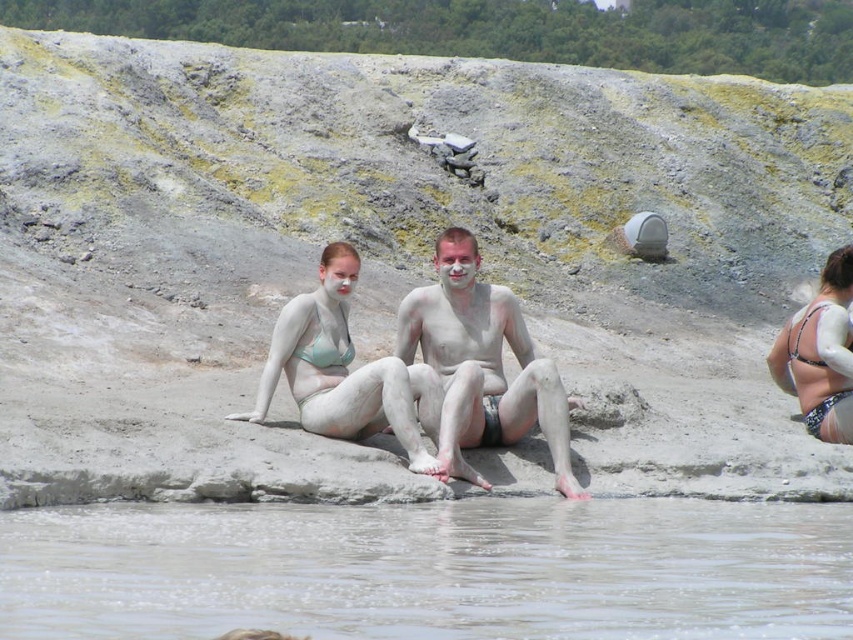
Image resolution: width=853 pixels, height=640 pixels. What are the coordinates of `white matte skin at center` in the screenshot? It's located at (480, 365).

Identify the location of white matte skin at center. Image resolution: width=853 pixels, height=640 pixels. (480, 365).

Is point (15, 525) less distant than point (321, 380)?

Yes, it is in front of point (321, 380).

Does clear mud at water center appear on the right side of matte clay bikini at center?

Yes, clear mud at water center is to the right of matte clay bikini at center.

Does point (666, 572) come farther from viewer compared to point (410, 470)?

No.

The height and width of the screenshot is (640, 853). I want to click on clear mud at water center, so click(x=430, y=570).

Looking at this image, is white matte skin at center positioned before matte clay bikini at center?

Yes, it is in front of matte clay bikini at center.

Between point (485, 369) and point (339, 408), which one is positioned in front?

Positioned in front is point (339, 408).

Where is `white matte skin at center`? white matte skin at center is located at coordinates (480, 365).